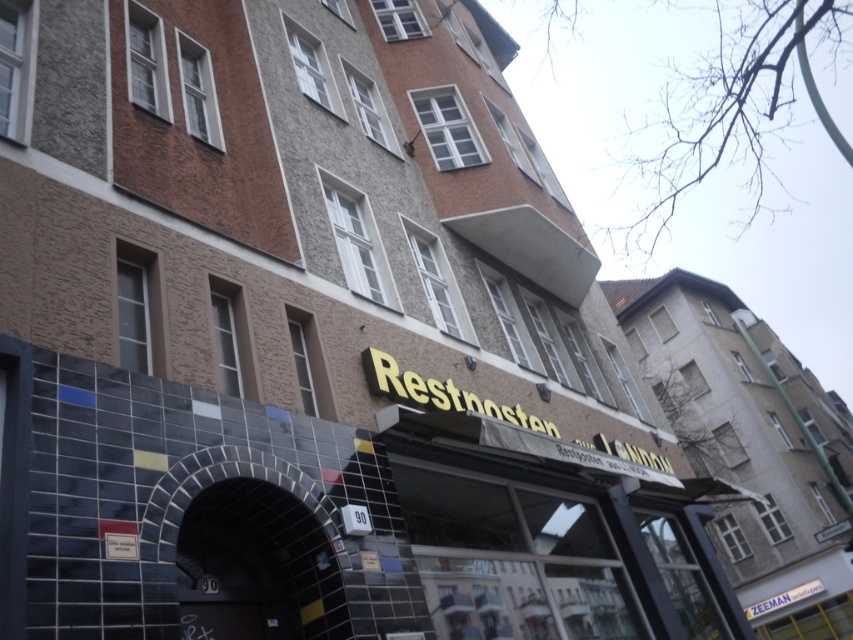
Question: Is matte yellow sign at center smaller than black tile archway at center?

Choices:
 (A) no
 (B) yes

Answer: (A)

Question: Does matte yellow sign at center have a smaller size compared to black tile archway at center?

Choices:
 (A) yes
 (B) no

Answer: (B)

Question: Considering the relative positions of matte yellow sign at center and black tile archway at center in the image provided, where is matte yellow sign at center located with respect to black tile archway at center?

Choices:
 (A) right
 (B) left

Answer: (A)

Question: Which point appears farthest from the camera in this image?

Choices:
 (A) (335, 636)
 (B) (809, 620)

Answer: (B)